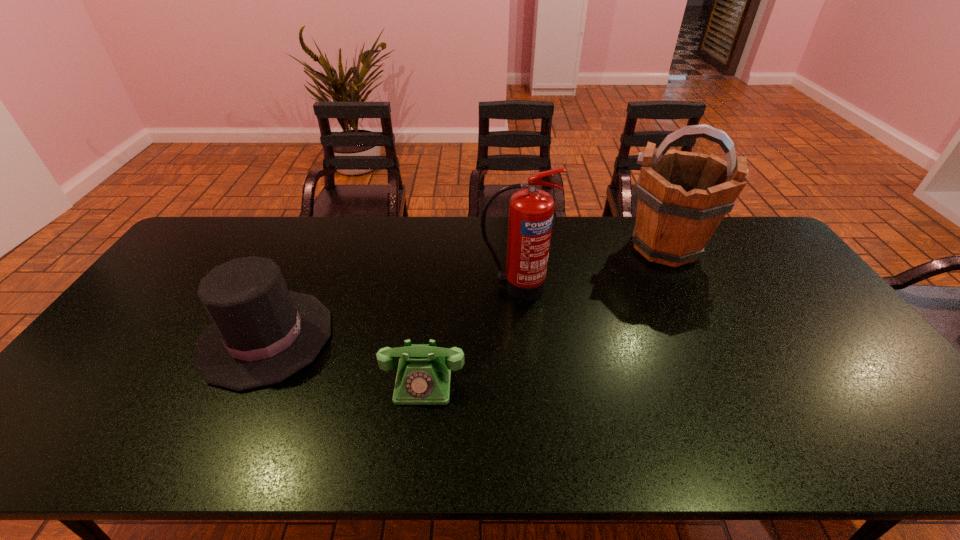
The image size is (960, 540). I want to click on the rightmost object, so click(683, 196).

Locate an element on the screen. The image size is (960, 540). the third object from left to right is located at coordinates (531, 211).

Identify the location of the leftmost object. The height and width of the screenshot is (540, 960). (261, 334).

Where is `dress hat`? This screenshot has width=960, height=540. dress hat is located at coordinates (261, 334).

At what (x,y) coordinates should I click in order to perform the action: click on the shortest object. Please return your answer as a coordinate pair (x, y). Looking at the image, I should click on click(423, 377).

Image resolution: width=960 pixels, height=540 pixels. Identify the location of telephone. (423, 377).

This screenshot has height=540, width=960. What are the coordinates of `vacant space located 0.210m on the left of the bucket` in the screenshot? It's located at click(x=560, y=247).

Where is `vacant space located on the surface of the fire extinguisher`? vacant space located on the surface of the fire extinguisher is located at coordinates (526, 406).

This screenshot has height=540, width=960. Identify the location of free space located 0.370m on the front of the leftmost object with the decoration. (467, 338).

What are the coordinates of `object that is positioned at the far edge` in the screenshot? It's located at (683, 196).